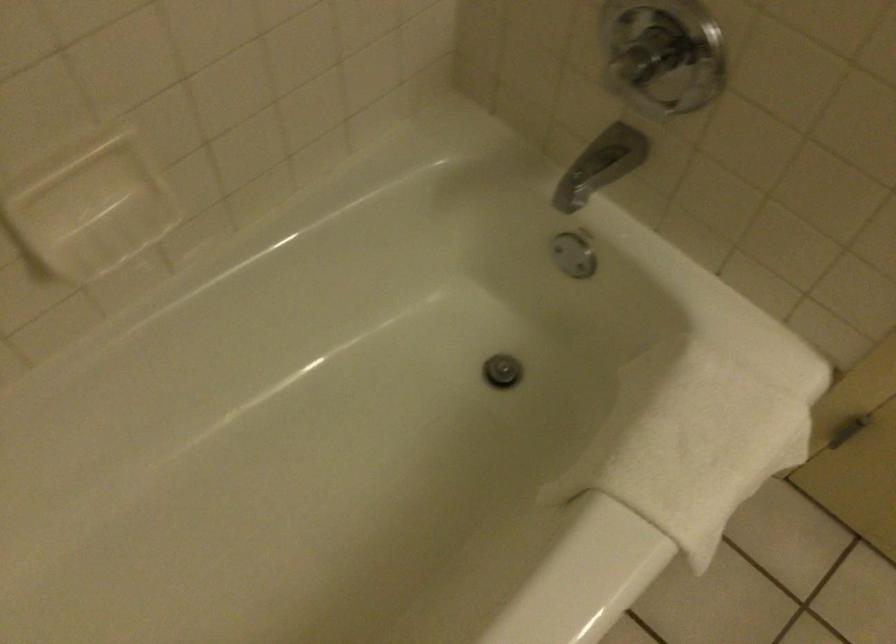
Identify the location of bathtub drain stopper. (503, 373).